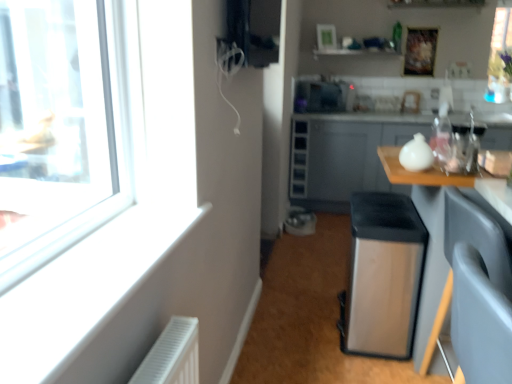
At what (x,y) coordinates should I click in order to perform the action: click on matte gray cabinet at right. Please return your answer as a coordinate pair (x, y). The height and width of the screenshot is (384, 512). Looking at the image, I should click on (347, 156).

Image resolution: width=512 pixels, height=384 pixels. I want to click on satin silver water heater at center, so click(382, 276).

Identify the location of matte gray cabinet at right. (347, 156).

From a real-world perspective, is matte gray cabinet at right above or below metallic gray drawer at center, placed as the 2th drawer when sorted from top to bottom?

matte gray cabinet at right is below metallic gray drawer at center, placed as the 2th drawer when sorted from top to bottom.

Which is correct: matte gray cabinet at right is inside metallic gray drawer at center, placed as the 2th drawer when sorted from top to bottom, or outside of it?

matte gray cabinet at right lies outside metallic gray drawer at center, placed as the 2th drawer when sorted from top to bottom.

Which is more to the right, matte gray cabinet at right or metallic gray drawer at center, placed as the 1th drawer when sorted from bottom to top?

Positioned to the right is matte gray cabinet at right.

Does matte gray cabinet at right come behind metallic gray drawer at center, placed as the 2th drawer when sorted from top to bottom?

No, it is not.

Between satin silver trash can at center and metallic gray drawer at center, placed as the 2th drawer when sorted from top to bottom, which one has more height?

With more height is metallic gray drawer at center, placed as the 2th drawer when sorted from top to bottom.

Which is behind, satin silver trash can at center or metallic gray drawer at center, placed as the 1th drawer when sorted from bottom to top?

metallic gray drawer at center, placed as the 1th drawer when sorted from bottom to top, is more distant.

Is satin silver trash can at center positioned with its back to metallic gray drawer at center, placed as the 2th drawer when sorted from top to bottom?

No, satin silver trash can at center is not facing the opposite direction of metallic gray drawer at center, placed as the 2th drawer when sorted from top to bottom.

Is matte gray cabinet at right to the right of metallic gray drawer at center, placed as the second drawer when sorted from bottom to top, from the viewer's perspective?

Yes.

Is point (391, 138) positioned before point (296, 125)?

Yes.

Is metallic gray drawer at center, placed as the second drawer when sorted from bottom to top, a part of matte gray cabinet at right?

Yes, metallic gray drawer at center, placed as the second drawer when sorted from bottom to top, is a part of matte gray cabinet at right.

From the image's perspective, which is below, matte gray cabinet at right or metallic gray drawer at center, placed as the second drawer when sorted from bottom to top?

From the image's view, matte gray cabinet at right is below.

From a real-world perspective, is transparent plastic bottle at upper right under metallic gray drawer at center, placed as the second drawer when sorted from bottom to top?

No, from a real-world perspective, transparent plastic bottle at upper right is not under metallic gray drawer at center, placed as the second drawer when sorted from bottom to top.

Between transparent plastic bottle at upper right and metallic gray drawer at center, which appears as the 1th drawer when viewed from the top, which one appears on the right side from the viewer's perspective?

transparent plastic bottle at upper right.

From the image's perspective, which is below, transparent plastic bottle at upper right or metallic gray drawer at center, placed as the second drawer when sorted from bottom to top?

transparent plastic bottle at upper right is shown below in the image.

Considering their positions, is transparent plastic bottle at upper right located in front of or behind metallic gray drawer at center, placed as the second drawer when sorted from bottom to top?

Visually, transparent plastic bottle at upper right is located in front of metallic gray drawer at center, placed as the second drawer when sorted from bottom to top.

From a real-world perspective, is satin black microwave at upper center physically below matte gray cabinet at right?

No, from a real-world perspective, satin black microwave at upper center is not below matte gray cabinet at right.

Is satin black microwave at upper center oriented away from matte gray cabinet at right?

satin black microwave at upper center does not have its back to matte gray cabinet at right.

Based on their positions, is satin black microwave at upper center located to the left or right of matte gray cabinet at right?

From the image, it's evident that satin black microwave at upper center is to the left of matte gray cabinet at right.

Is satin black microwave at upper center far away from matte gray cabinet at right?

No, satin black microwave at upper center is not far from matte gray cabinet at right.

Considering the positions of objects satin silver trash can at center and metallic gray drawer at center, which appears as the 1th drawer when viewed from the top, in the image provided, who is more to the right, satin silver trash can at center or metallic gray drawer at center, which appears as the 1th drawer when viewed from the top,?

Positioned to the right is satin silver trash can at center.

From a real-world perspective, between satin silver trash can at center and metallic gray drawer at center, which appears as the 1th drawer when viewed from the top, who is vertically higher?

metallic gray drawer at center, which appears as the 1th drawer when viewed from the top, from a real-world perspective.

Is satin silver trash can at center next to metallic gray drawer at center, placed as the second drawer when sorted from bottom to top?

No, satin silver trash can at center is not with metallic gray drawer at center, placed as the second drawer when sorted from bottom to top.

From the image's perspective, which object appears higher, satin silver trash can at center or metallic gray drawer at center, placed as the second drawer when sorted from bottom to top?

metallic gray drawer at center, placed as the second drawer when sorted from bottom to top, is shown above in the image.

From a real-world perspective, relative to matte gray cabinet at right, is metallic gray drawer at center, which appears as the 1th drawer when viewed from the top, vertically above or below?

Clearly, from a real-world perspective, metallic gray drawer at center, which appears as the 1th drawer when viewed from the top, is above matte gray cabinet at right.

Considering the sizes of objects metallic gray drawer at center, placed as the second drawer when sorted from bottom to top, and matte gray cabinet at right in the image provided, who is taller, metallic gray drawer at center, placed as the second drawer when sorted from bottom to top, or matte gray cabinet at right?

With more height is matte gray cabinet at right.

Is metallic gray drawer at center, which appears as the 1th drawer when viewed from the top, touching matte gray cabinet at right?

No, metallic gray drawer at center, which appears as the 1th drawer when viewed from the top, is not in contact with matte gray cabinet at right.

Where is `cabinetry in front of the metallic gray drawer at center, placed as the 2th drawer when sorted from top to bottom`? cabinetry in front of the metallic gray drawer at center, placed as the 2th drawer when sorted from top to bottom is located at coordinates (347, 156).

Identify the location of the 2nd drawer behind the satin silver trash can at center, starting your count from the anchor. The width and height of the screenshot is (512, 384). (300, 143).

Looking at the image, which one is located closer to metallic gray drawer at center, placed as the second drawer when sorted from bottom to top, metallic gray drawer at center, placed as the 2th drawer when sorted from top to bottom, or satin black microwave at upper center?

The object closer to metallic gray drawer at center, placed as the second drawer when sorted from bottom to top, is metallic gray drawer at center, placed as the 2th drawer when sorted from top to bottom.

Estimate the real-world distances between objects in this image. Which object is further from satin silver trash can at center, wooden table at right or matte gray cabinet at right?

The object further to satin silver trash can at center is matte gray cabinet at right.

Based on their spatial positions, is metallic gray drawer at center, placed as the second drawer when sorted from bottom to top, or wooden table at right closer to satin black microwave at upper center?

metallic gray drawer at center, placed as the second drawer when sorted from bottom to top.

From the image, which object appears to be farther from wooden table at right, satin silver water heater at center or satin silver trash can at center?

Based on the image, satin silver trash can at center appears to be further to wooden table at right.

When comparing their distances from metallic gray drawer at center, placed as the 2th drawer when sorted from top to bottom, does transparent plastic bottle at upper right or matte gray cabinet at right seem further?

transparent plastic bottle at upper right.

Based on their spatial positions, is metallic gray drawer at center, placed as the 1th drawer when sorted from bottom to top, or metallic gray drawer at center, placed as the second drawer when sorted from bottom to top, closer to matte gray cabinet at right?

Among the two, metallic gray drawer at center, placed as the 1th drawer when sorted from bottom to top, is located nearer to matte gray cabinet at right.

Consider the image. Which object lies nearer to the anchor point metallic gray drawer at center, placed as the 2th drawer when sorted from top to bottom, metallic gray drawer at center, which appears as the 1th drawer when viewed from the top, or satin black microwave at upper center?

metallic gray drawer at center, which appears as the 1th drawer when viewed from the top, is positioned closer to the anchor metallic gray drawer at center, placed as the 2th drawer when sorted from top to bottom.

From the image, which object appears to be nearer to metallic gray drawer at center, which appears as the 1th drawer when viewed from the top, wooden table at right or satin silver trash can at center?

The object closer to metallic gray drawer at center, which appears as the 1th drawer when viewed from the top, is satin silver trash can at center.

The height and width of the screenshot is (384, 512). In order to click on cabinetry located between wooden table at right and metallic gray drawer at center, which appears as the 1th drawer when viewed from the top, in the depth direction in this screenshot , I will do `click(347, 156)`.

What are the coordinates of `bottle between satin silver water heater at center and metallic gray drawer at center, placed as the 2th drawer when sorted from top to bottom, in the front-back direction` in the screenshot? It's located at (442, 136).

Image resolution: width=512 pixels, height=384 pixels. I want to click on water heater positioned between satin silver trash can at center and satin black microwave at upper center from near to far, so click(x=382, y=276).

Where is `drawer between wooden table at right and satin black microwave at upper center from front to back`? drawer between wooden table at right and satin black microwave at upper center from front to back is located at coordinates (301, 127).